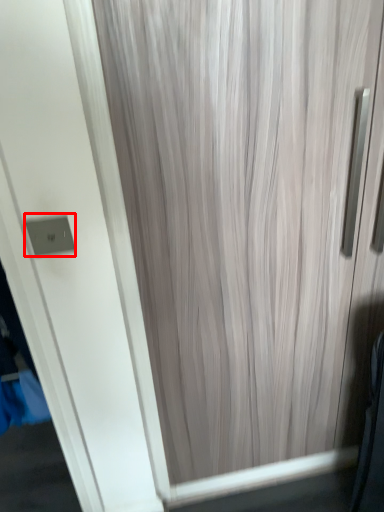
Question: Where is electric outlet (annotated by the red box) located in relation to curtain in the image?

Choices:
 (A) right
 (B) left

Answer: (B)